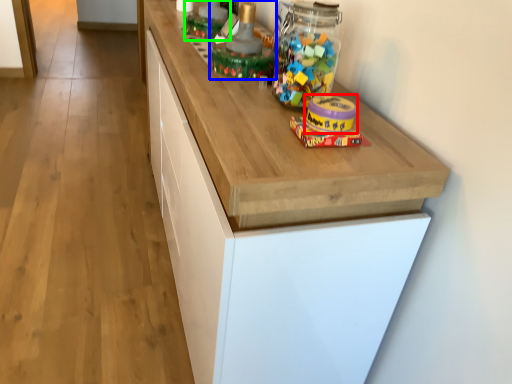
Question: Which is nearer to the toy (highlighted by a red box)? toy (highlighted by a blue box) or toy (highlighted by a green box).

Choices:
 (A) toy
 (B) toy

Answer: (A)